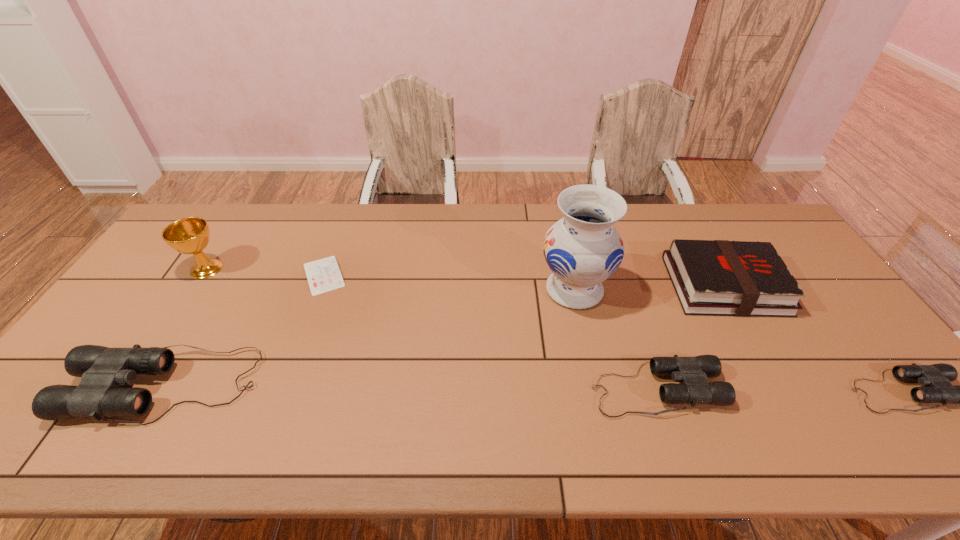
You are a GUI agent. You are given a task and a screenshot of the screen. Output one action in this format:
    pyautogui.click(x=<x>, y=<y>)
    Task: Click on the vacant space located on the back of the tallest object
    
    Given the screenshot: What is the action you would take?
    pyautogui.click(x=561, y=225)

You are a GUI agent. You are given a task and a screenshot of the screen. Output one action in this format:
    pyautogui.click(x=<x>, y=<y>)
    Task: Click on the free space located 0.080m on the back of the diary
    
    Given the screenshot: What is the action you would take?
    pyautogui.click(x=337, y=240)

I want to click on binoculars present at the left edge, so click(x=103, y=370).

The height and width of the screenshot is (540, 960). Find the location of `chalice that is positioned at the left edge`. chalice that is positioned at the left edge is located at coordinates (191, 235).

Find the location of a particular element. The image size is (960, 540). object situated at the right edge is located at coordinates (711, 277).

Where is `object at the near left corner`? object at the near left corner is located at coordinates (103, 370).

At what (x,y) coordinates should I click in order to perform the action: click on blank space at the far edge. Please return your answer as a coordinate pair (x, y). The image size is (960, 540). Looking at the image, I should click on (542, 206).

The width and height of the screenshot is (960, 540). In order to click on vacant position at the near edge of the desktop in this screenshot , I will do `click(320, 393)`.

Locate an element on the screen. vacant space at the left edge of the desktop is located at coordinates (145, 301).

In the image, there is a desktop. In order to click on free space at the right edge in this screenshot , I will do `click(857, 362)`.